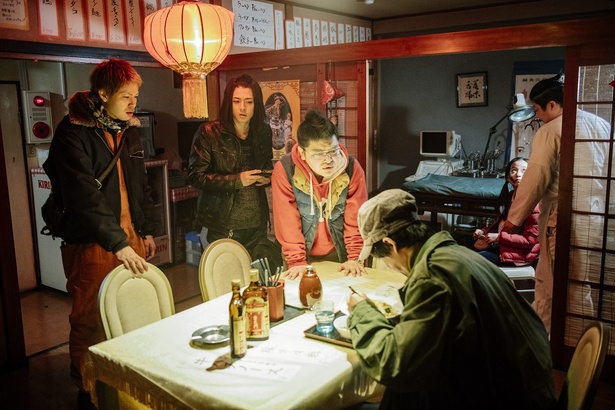
Locate an element on the screen. The height and width of the screenshot is (410, 615). screen is located at coordinates (435, 141).